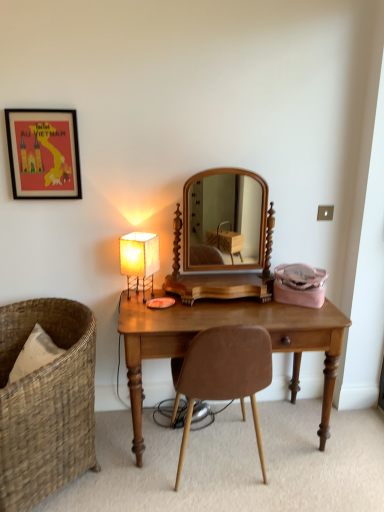
Locate an element on the screen. The image size is (384, 512). vacant space underneath brown leather chair at center, which ranks as the 1th chair in right-to-left order (from a real-world perspective) is located at coordinates (228, 477).